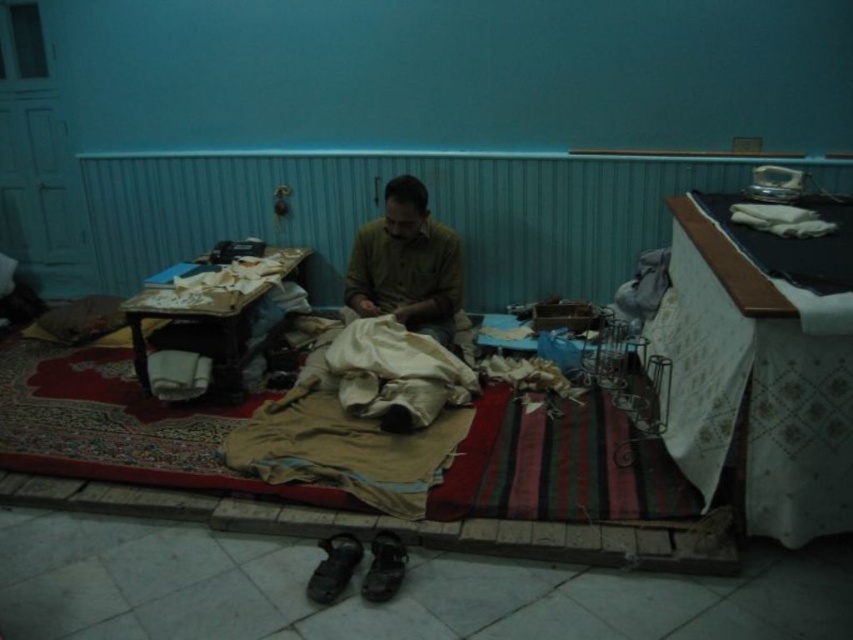
Question: Which object is positioned farthest from the beige fabric mat at center?

Choices:
 (A) dark brown leather sandal at lower center
 (B) beige cotton blanket at center
 (C) brown cotton shirt at center

Answer: (C)

Question: Which object appears farthest from the camera in this image?

Choices:
 (A) beige fabric mat at center
 (B) dark brown leather sandal at lower center
 (C) beige cotton blanket at center

Answer: (A)

Question: Which of the following is the farthest from the observer?

Choices:
 (A) (222, 456)
 (B) (381, 541)
 (C) (421, 243)

Answer: (C)

Question: Is dark brown leather sandal at lower center above dark brown leather shoe at lower center?

Choices:
 (A) yes
 (B) no

Answer: (B)

Question: Is beige fabric mat at center thinner than dark brown leather sandal at lower center?

Choices:
 (A) no
 (B) yes

Answer: (A)

Question: Can you confirm if beige fabric mat at center is positioned to the right of dark brown leather sandal at lower center?

Choices:
 (A) yes
 (B) no

Answer: (B)